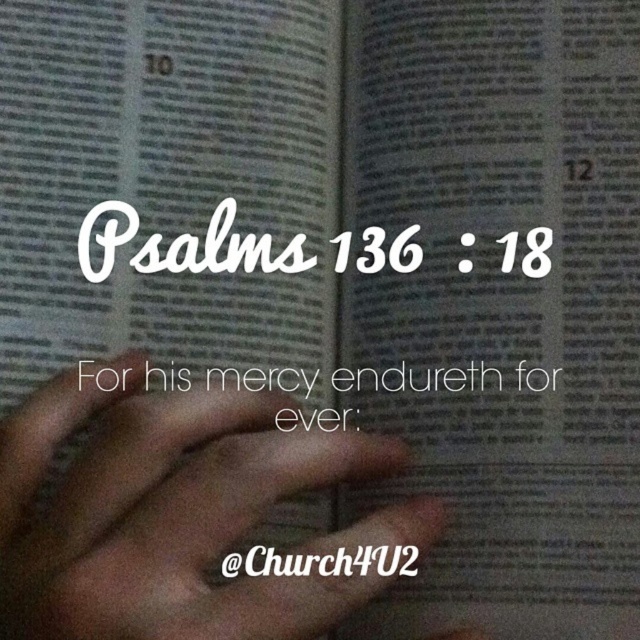
Is brown skin at center smaller than white paper text at center?

Incorrect, brown skin at center is not smaller in size than white paper text at center.

Between brown skin at center and white paper text at center, which one is positioned lower?

brown skin at center

Is point (168, 436) positioned before point (362, 266)?

Yes, it is.

Where is `brown skin at center`? This screenshot has width=640, height=640. brown skin at center is located at coordinates (164, 512).